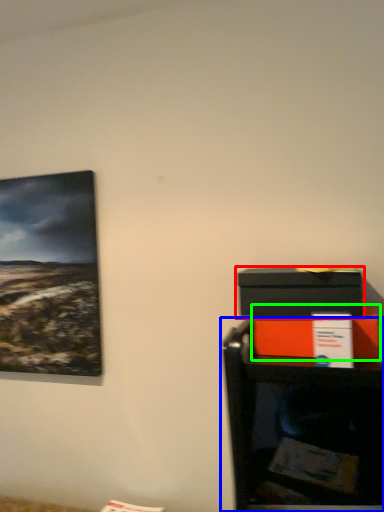
Question: Estimate the real-world distances between objects in this image. Which object is closer to box (highlighted by a red box), furniture (highlighted by a blue box) or box (highlighted by a green box)?

Choices:
 (A) furniture
 (B) box

Answer: (B)